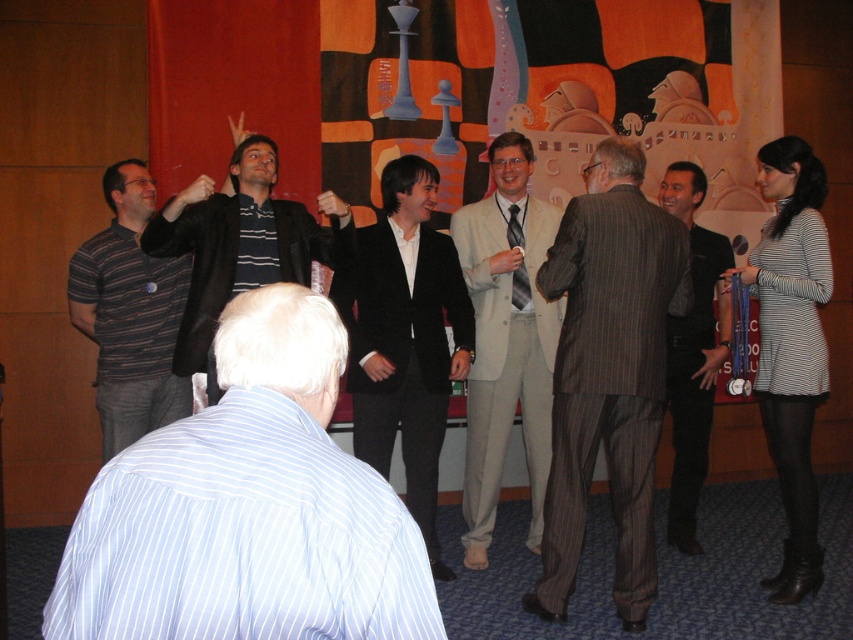
Question: Can you confirm if black smooth suit at center is positioned to the right of black striped sweater at upper center?

Choices:
 (A) no
 (B) yes

Answer: (B)

Question: Does striped pinstripe suit at center appear on the right side of striped cotton polo shirt at left?

Choices:
 (A) no
 (B) yes

Answer: (B)

Question: Is light beige suit at center smaller than black pinstripe suit at center?

Choices:
 (A) yes
 (B) no

Answer: (A)

Question: Which point is closer to the camera?

Choices:
 (A) (267, 140)
 (B) (76, 316)

Answer: (A)

Question: Which point is closer to the camera?

Choices:
 (A) light beige suit at center
 (B) blue striped shirt at lower left
 (C) striped cotton polo shirt at left

Answer: (B)

Question: Considering the real-world distances, which object is closest to the black striped sweater at upper center?

Choices:
 (A) striped cotton polo shirt at left
 (B) light beige suit at center
 (C) blue striped shirt at lower left

Answer: (A)